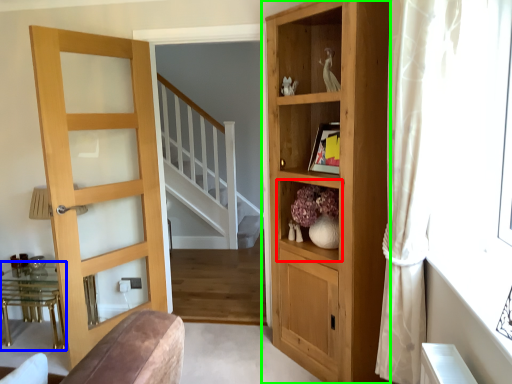
Question: Which is farther away from shelf (highlighted by a red box)? table (highlighted by a blue box) or cupboard (highlighted by a green box)?

Choices:
 (A) table
 (B) cupboard

Answer: (A)